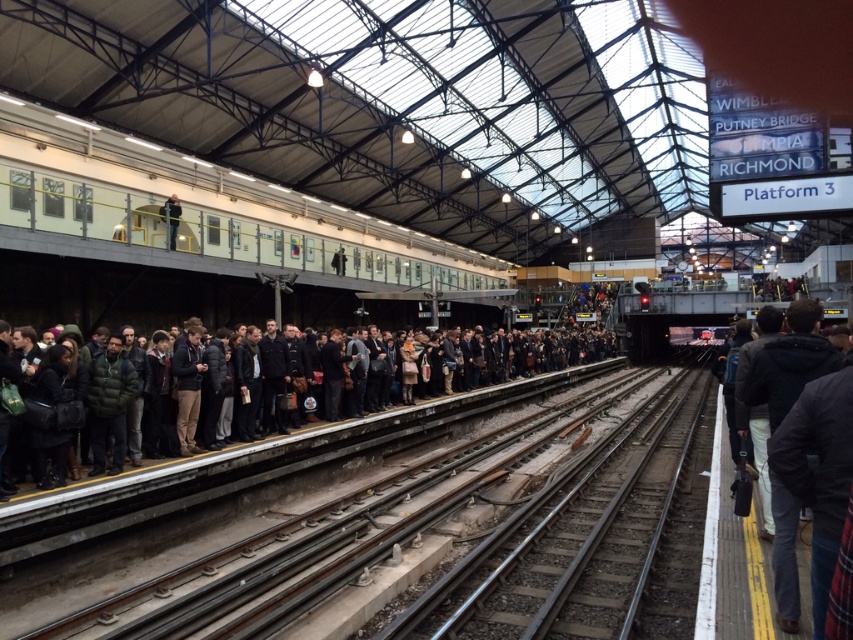
Is point (27, 108) positioned after point (550, 524)?

Yes.

Between metallic silver train at upper center and smooth steel tracks at center, which one is positioned lower?

smooth steel tracks at center is below.

Which is behind, point (165, 166) or point (560, 497)?

Positioned behind is point (165, 166).

I want to click on metallic silver train at upper center, so click(x=213, y=211).

Who is shorter, metallic silver train at upper center or smooth concrete track at center?

smooth concrete track at center is shorter.

Which is behind, point (248, 240) or point (450, 499)?

Positioned behind is point (248, 240).

Is point (45, 250) positioned behind point (508, 445)?

No.

Image resolution: width=853 pixels, height=640 pixels. Identify the location of metallic silver train at upper center. (213, 211).

Consider the image. Is smooth concrete track at center below smooth steel tracks at center?

Incorrect, smooth concrete track at center is not positioned below smooth steel tracks at center.

What do you see at coordinates (328, 538) in the screenshot? This screenshot has width=853, height=640. I see `smooth concrete track at center` at bounding box center [328, 538].

In order to click on smooth concrete track at center in this screenshot , I will do `click(328, 538)`.